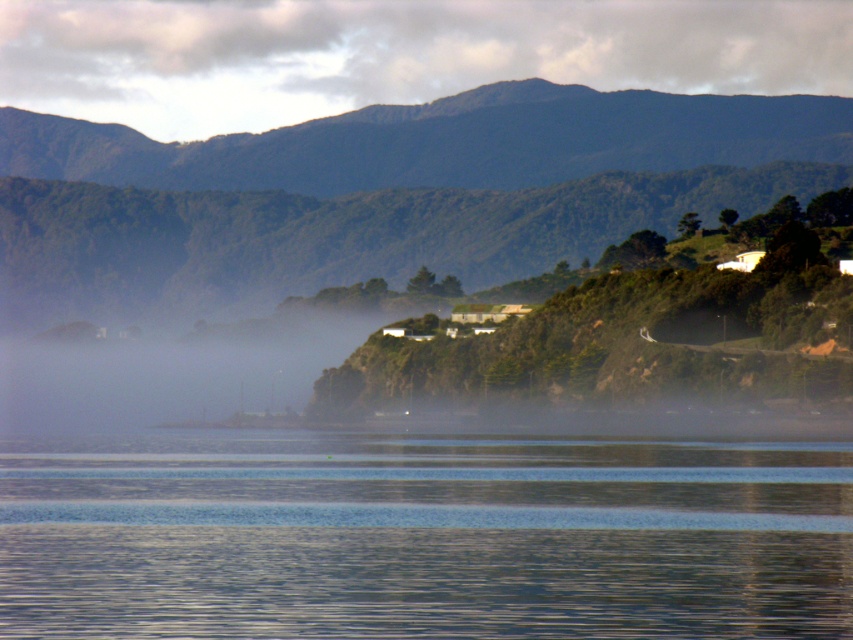
Question: Which of the following is the farthest from the observer?

Choices:
 (A) transparent glass water at center
 (B) dark green textured mountain at upper center

Answer: (B)

Question: Is transparent glass water at center closer to the viewer compared to green forested mountain at upper center?

Choices:
 (A) yes
 (B) no

Answer: (A)

Question: Among these objects, which one is farthest from the camera?

Choices:
 (A) transparent glass water at center
 (B) green forested mountain at upper center
 (C) dark green textured mountain at upper center

Answer: (C)

Question: Does transparent glass water at center appear on the left side of green forested mountain at upper center?

Choices:
 (A) yes
 (B) no

Answer: (B)

Question: Does transparent glass water at center appear under dark green textured mountain at upper center?

Choices:
 (A) yes
 (B) no

Answer: (A)

Question: Which is farther from the dark green textured mountain at upper center?

Choices:
 (A) transparent glass water at center
 (B) green forested mountain at upper center

Answer: (A)